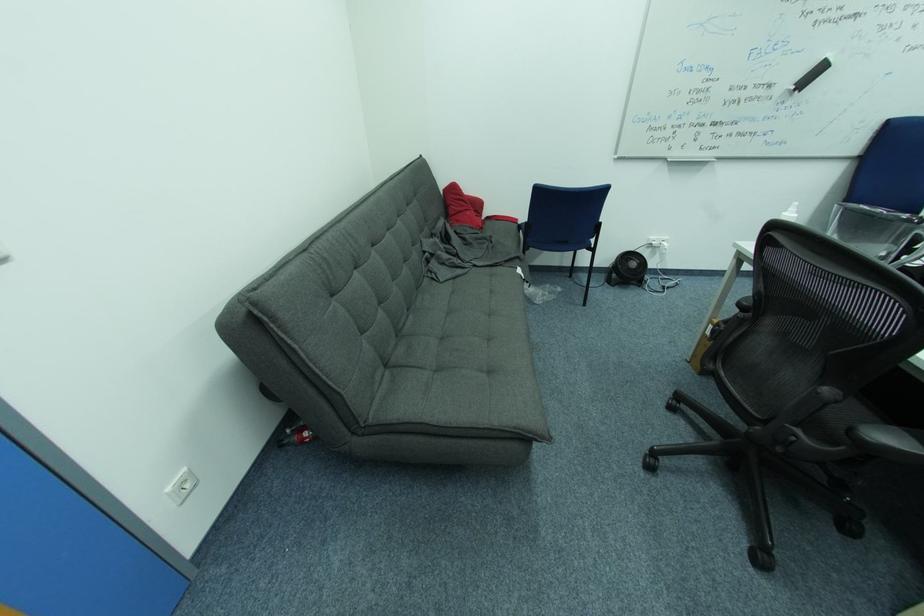
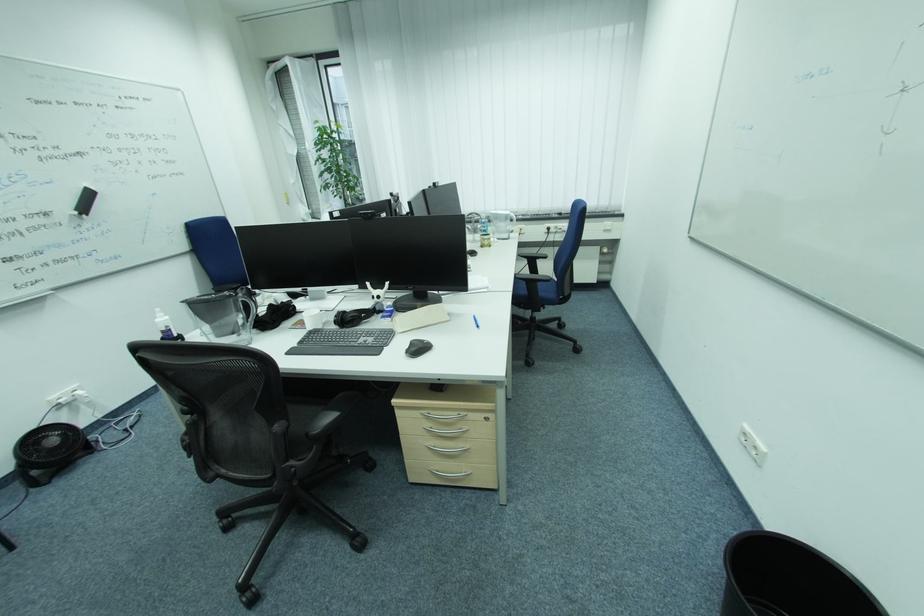
Where in the second image is the point corresponding to [792,215] from the first image?

(164, 321)